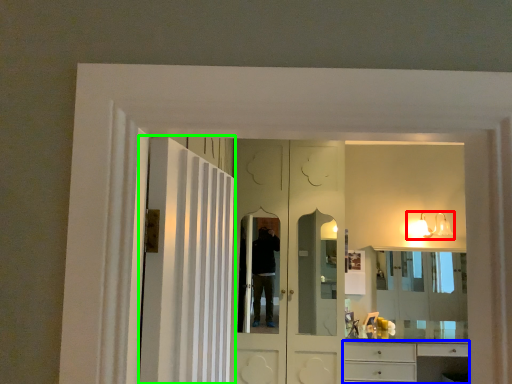
Question: Which is farther away from light fixture (highlighted by a red box)? cabinetry (highlighted by a blue box) or door (highlighted by a green box)?

Choices:
 (A) cabinetry
 (B) door

Answer: (B)